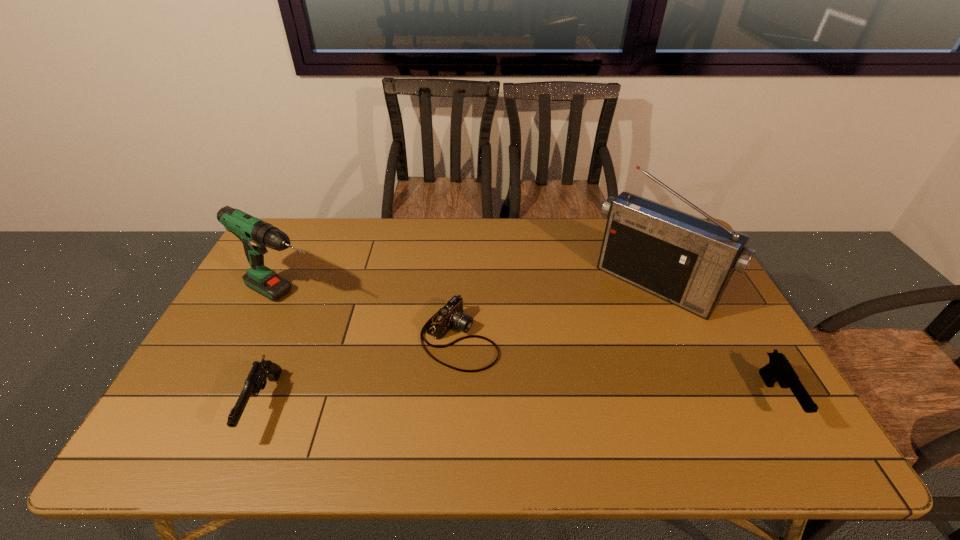
Identify the location of radio receiver that is at the right edge. (685, 260).

Locate an element on the screen. object that is positioned at the far right corner is located at coordinates (685, 260).

Locate an element on the screen. This screenshot has width=960, height=540. object positioned at the near right corner is located at coordinates (778, 369).

Identify the location of free point at the far edge. Image resolution: width=960 pixels, height=540 pixels. (336, 234).

At what (x,y) coordinates should I click in order to perform the action: click on vacant region at the near edge of the desktop. Please return your answer as a coordinate pair (x, y). Image resolution: width=960 pixels, height=540 pixels. Looking at the image, I should click on (273, 400).

Find the location of a particular element. The width and height of the screenshot is (960, 540). vacant space at the left edge is located at coordinates (276, 330).

Where is `free space at the right edge of the desktop`? free space at the right edge of the desktop is located at coordinates (708, 344).

I want to click on blank space at the far left corner of the desktop, so click(285, 226).

The height and width of the screenshot is (540, 960). I want to click on vacant space at the near left corner of the desktop, so click(215, 407).

Find the location of a particular element. The width and height of the screenshot is (960, 540). free spot at the near right corner of the desktop is located at coordinates (762, 402).